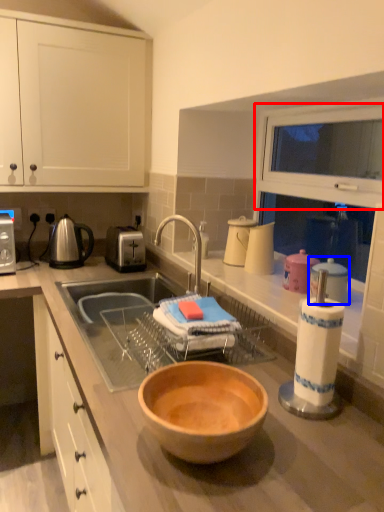
Question: Which of the following is the farthest to the observer, cabinetry (highlighted by a red box) or appliance (highlighted by a blue box)?

Choices:
 (A) cabinetry
 (B) appliance

Answer: (A)